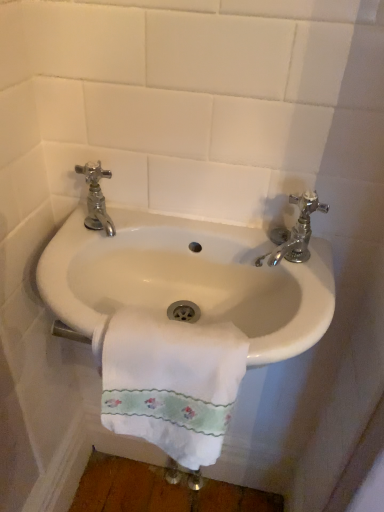
Question: Is chrome/metallic faucet at upper left, arranged as the 1th tap when viewed from the left, far from white glossy sink at center?

Choices:
 (A) no
 (B) yes

Answer: (A)

Question: From a real-world perspective, is chrome/metallic faucet at upper left, the 2th tap when ordered from right to left, under white glossy sink at center?

Choices:
 (A) no
 (B) yes

Answer: (A)

Question: Is chrome/metallic faucet at upper left, the 2th tap when ordered from right to left, facing towards white glossy sink at center?

Choices:
 (A) yes
 (B) no

Answer: (B)

Question: Considering the relative sizes of chrome/metallic faucet at upper left, arranged as the 1th tap when viewed from the left, and white glossy sink at center in the image provided, is chrome/metallic faucet at upper left, arranged as the 1th tap when viewed from the left, taller than white glossy sink at center?

Choices:
 (A) no
 (B) yes

Answer: (B)

Question: Does chrome/metallic faucet at upper left, arranged as the 1th tap when viewed from the left, appear on the right side of white glossy sink at center?

Choices:
 (A) yes
 (B) no

Answer: (B)

Question: Does chrome/metallic faucet at upper left, arranged as the 1th tap when viewed from the left, have a lesser height compared to white glossy sink at center?

Choices:
 (A) yes
 (B) no

Answer: (B)

Question: Is the depth of chrome/metallic faucet at right, the 2th tap positioned from the left, greater than that of white glossy sink at center?

Choices:
 (A) yes
 (B) no

Answer: (A)

Question: From the image's perspective, is chrome/metallic faucet at right, marked as the 1th tap in a right-to-left arrangement, over white glossy sink at center?

Choices:
 (A) yes
 (B) no

Answer: (A)

Question: Is chrome/metallic faucet at right, the 2th tap positioned from the left, outside of white glossy sink at center?

Choices:
 (A) yes
 (B) no

Answer: (A)

Question: Is chrome/metallic faucet at right, the 2th tap positioned from the left, facing towards white glossy sink at center?

Choices:
 (A) yes
 (B) no

Answer: (B)

Question: From a real-world perspective, is chrome/metallic faucet at right, the 2th tap positioned from the left, under white glossy sink at center?

Choices:
 (A) no
 (B) yes

Answer: (A)

Question: From the image's perspective, would you say chrome/metallic faucet at right, marked as the 1th tap in a right-to-left arrangement, is shown under white glossy sink at center?

Choices:
 (A) no
 (B) yes

Answer: (A)

Question: Is chrome/metallic faucet at right, marked as the 1th tap in a right-to-left arrangement, placed right next to chrome/metallic faucet at upper left, arranged as the 1th tap when viewed from the left?

Choices:
 (A) no
 (B) yes

Answer: (A)